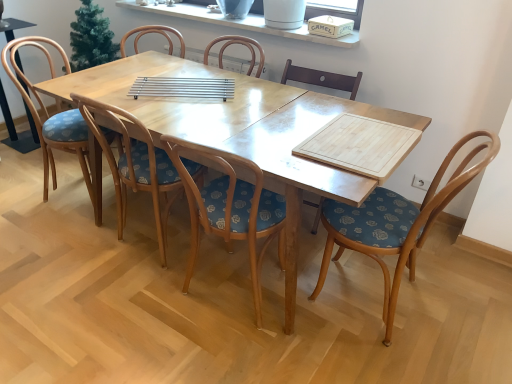
At what (x,y) coordinates should I click in order to perform the action: click on vacant space to the left of wooden chair with floral cushion at center, the first chair from the left. Please return your answer as a coordinate pair (x, y). This screenshot has height=384, width=512. Looking at the image, I should click on (23, 188).